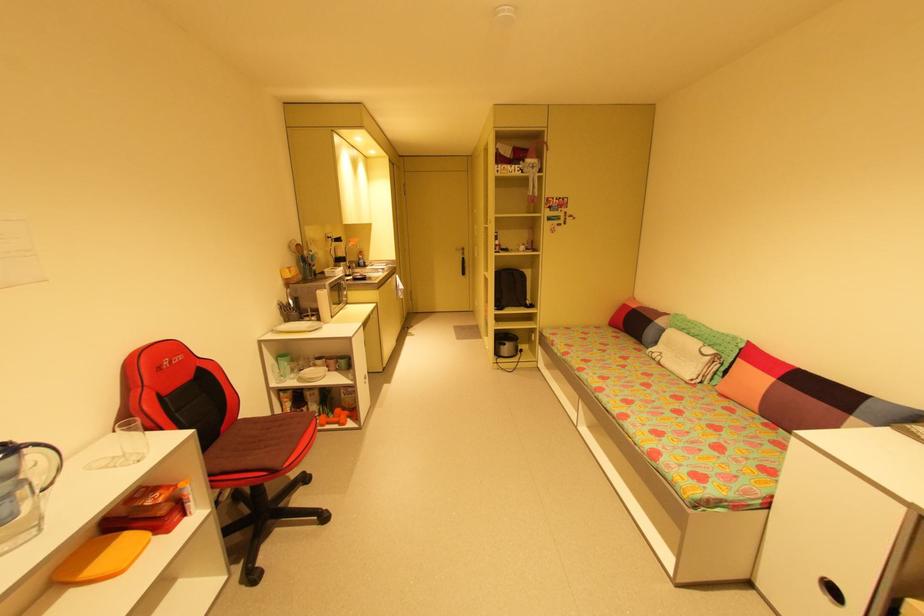
Where would you lift the black rice cooker? Please return your answer as a coordinate pair (x, y).

(505, 345)